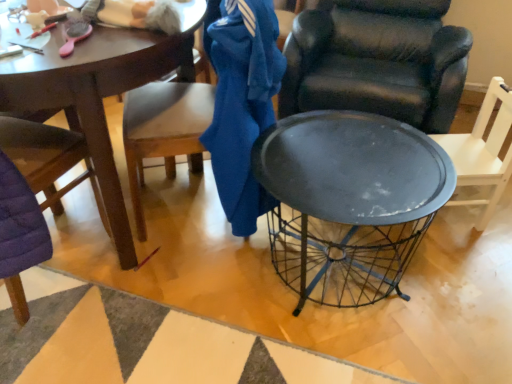
Question: Is matte black chair at right, positioned as the fourth chair in left-to-right order, inside wooden chair at left, arranged as the second chair when viewed from the left?

Choices:
 (A) no
 (B) yes

Answer: (A)

Question: From a real-world perspective, is wooden chair at left, placed as the third chair when sorted from right to left, over matte black chair at right, positioned as the fourth chair in left-to-right order?

Choices:
 (A) no
 (B) yes

Answer: (B)

Question: Is wooden chair at left, arranged as the second chair when viewed from the left, further to the viewer compared to matte black chair at right, which ranks as the 1th chair in right-to-left order?

Choices:
 (A) no
 (B) yes

Answer: (A)

Question: Is wooden chair at left, arranged as the second chair when viewed from the left, bigger than matte black chair at right, positioned as the fourth chair in left-to-right order?

Choices:
 (A) no
 (B) yes

Answer: (B)

Question: Considering the relative positions of wooden chair at left, arranged as the second chair when viewed from the left, and matte black chair at right, which ranks as the 1th chair in right-to-left order, in the image provided, is wooden chair at left, arranged as the second chair when viewed from the left, to the right of matte black chair at right, which ranks as the 1th chair in right-to-left order, from the viewer's perspective?

Choices:
 (A) yes
 (B) no

Answer: (B)

Question: Considering the positions of point (332, 185) and point (245, 195), is point (332, 185) closer or farther from the camera than point (245, 195)?

Choices:
 (A) closer
 (B) farther

Answer: (A)

Question: From a real-world perspective, is metallic black table at center above or below blue cotton jacket at center?

Choices:
 (A) above
 (B) below

Answer: (B)

Question: Is metallic black table at center in front of or behind blue cotton jacket at center in the image?

Choices:
 (A) front
 (B) behind

Answer: (A)

Question: In terms of width, does metallic black table at center look wider or thinner when compared to blue cotton jacket at center?

Choices:
 (A) thin
 (B) wide

Answer: (B)

Question: Is metallic wire basket at center in front of or behind blue cotton jacket at center in the image?

Choices:
 (A) behind
 (B) front

Answer: (B)

Question: In terms of height, does metallic wire basket at center look taller or shorter compared to blue cotton jacket at center?

Choices:
 (A) short
 (B) tall

Answer: (A)

Question: Which is correct: metallic wire basket at center is inside blue cotton jacket at center, or outside of it?

Choices:
 (A) inside
 (B) outside

Answer: (B)

Question: In terms of width, does metallic wire basket at center look wider or thinner when compared to blue cotton jacket at center?

Choices:
 (A) wide
 (B) thin

Answer: (A)

Question: Considering the positions of point (241, 145) and point (486, 177), is point (241, 145) closer or farther from the camera than point (486, 177)?

Choices:
 (A) farther
 (B) closer

Answer: (B)

Question: From a real-world perspective, is blue cotton jacket at center physically located above or below matte black chair at right, which ranks as the 1th chair in right-to-left order?

Choices:
 (A) above
 (B) below

Answer: (A)